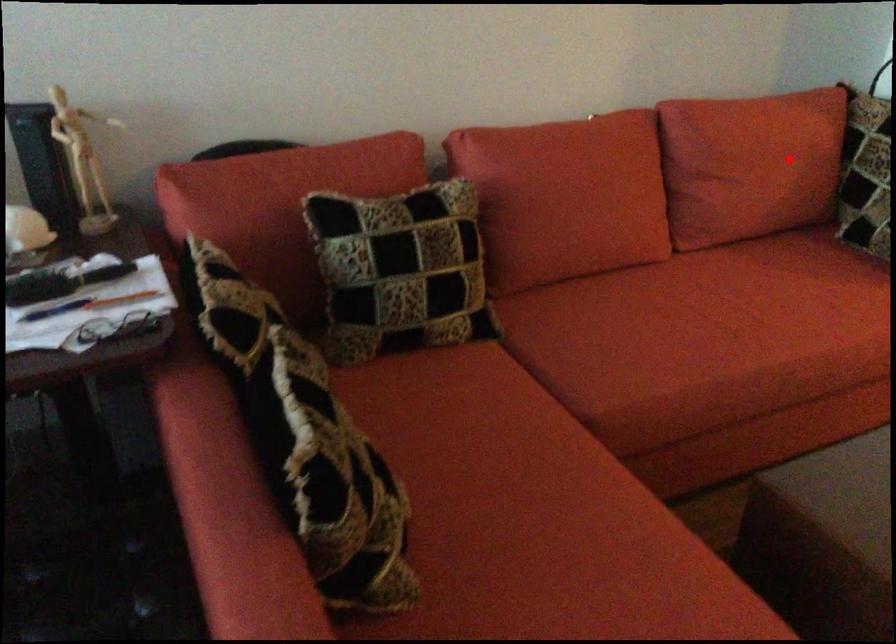
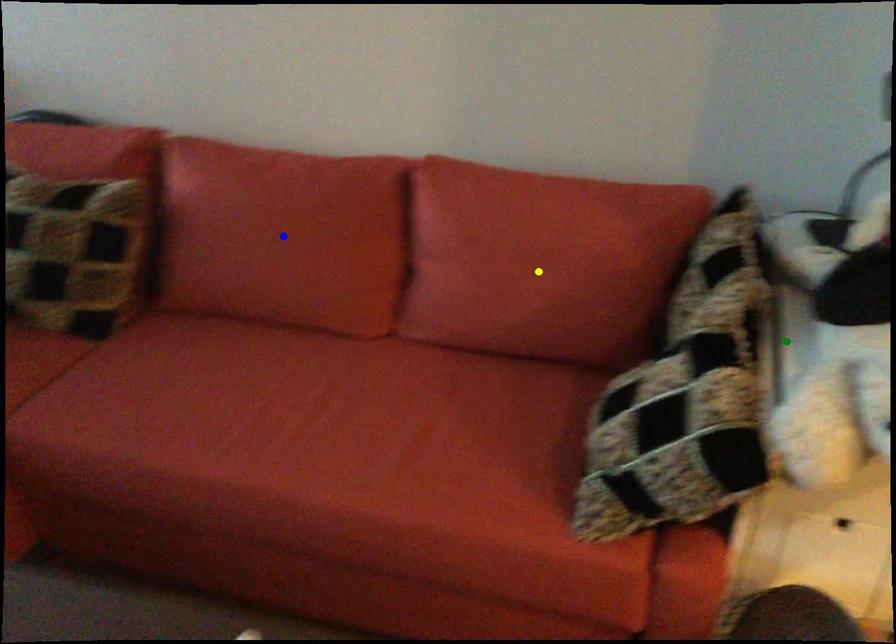
Question: I am providing you with two images of the same scene from different viewpoints. A red point is marked on the first image. You are given multiple points on the second image. In image 2, which mark is for the same physical point as the one in image 1?

Choices:
 (A) yellow point
 (B) green point
 (C) blue point

Answer: (A)